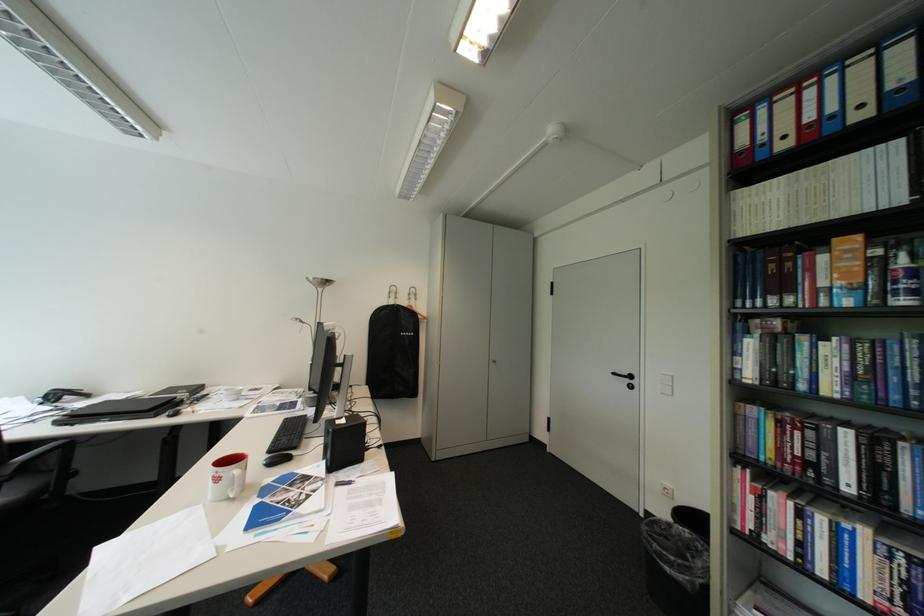
Where would you pull the cabinet door lock? Please return your answer as a coordinate pair (x, y).

(495, 363)